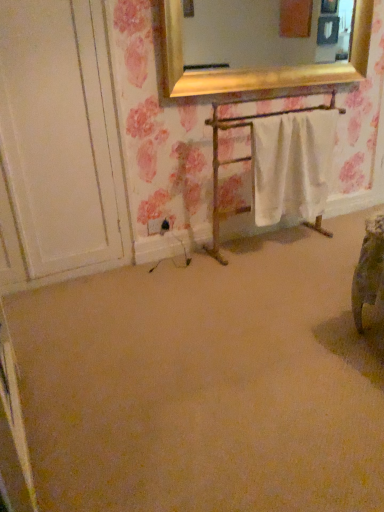
The height and width of the screenshot is (512, 384). In order to click on vacant space underneath white fabric towel rack at center (from a real-world perspective) in this screenshot , I will do `click(272, 242)`.